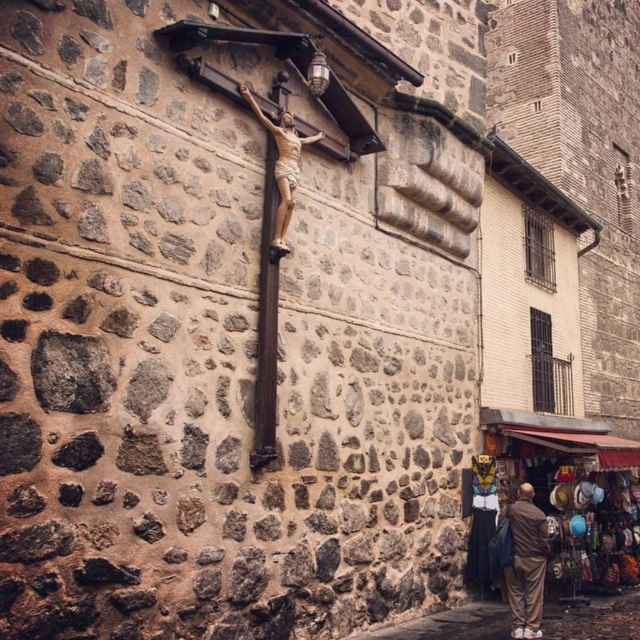
Question: Is brown fabric pants at lower right below wooden crucifix at center?

Choices:
 (A) no
 (B) yes

Answer: (B)

Question: Which of the following is the farthest from the observer?

Choices:
 (A) (516, 497)
 (B) (280, 234)

Answer: (A)

Question: Is brown fabric pants at lower right bigger than wooden crucifix at center?

Choices:
 (A) yes
 (B) no

Answer: (A)

Question: Does brown fabric pants at lower right come behind wooden crucifix at center?

Choices:
 (A) no
 (B) yes

Answer: (B)